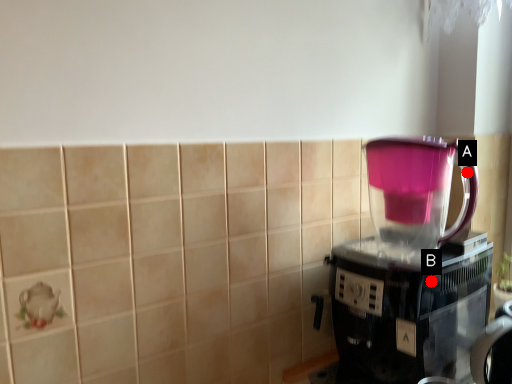
Question: Two points are circled on the image, labeled by A and B beside each circle. Which point appears farthest from the camera in this image?

Choices:
 (A) A is further
 (B) B is further

Answer: (A)